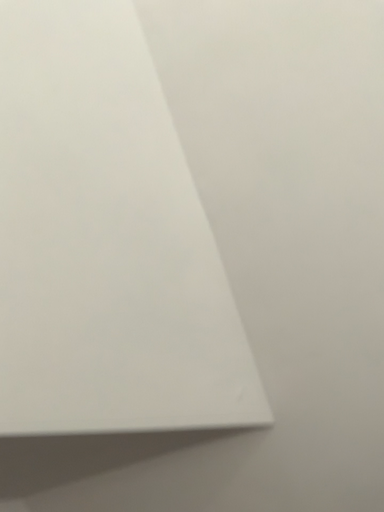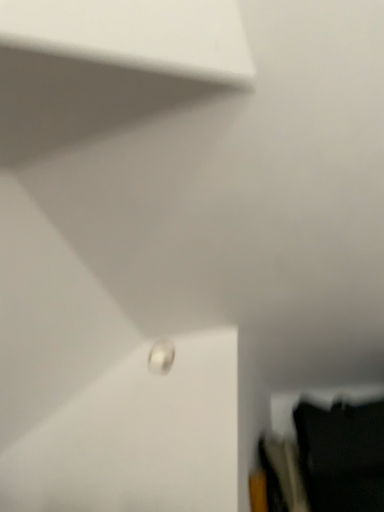
Question: How did the camera likely rotate when shooting the video?

Choices:
 (A) rotated upward
 (B) rotated downward

Answer: (B)